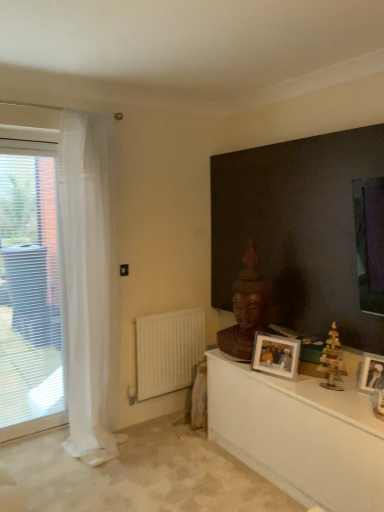
The image size is (384, 512). What do you see at coordinates (275, 355) in the screenshot?
I see `wooden photo frame at center, the 1th picture frame from the back` at bounding box center [275, 355].

Measure the distance between point (x=276, y=272) and camera.

Point (x=276, y=272) and camera are 9.17 feet apart from each other.

The height and width of the screenshot is (512, 384). What do you see at coordinates (306, 230) in the screenshot?
I see `dark wood buddha head at center` at bounding box center [306, 230].

In order to face metallic silver photo frame at right, the 2th picture frame positioned from the back, should I rotate leftwards or rightwards?

To align with it, rotate right about 23.465°.

The width and height of the screenshot is (384, 512). Describe the element at coordinates (371, 373) in the screenshot. I see `metallic silver photo frame at right, positioned as the 2th picture frame in left-to-right order` at that location.

Consider the image. What is the approximate width of transparent glass window at left?

The width of transparent glass window at left is 4.54 inches.

Measure the distance between white sheer curtain at left and camera.

The distance of white sheer curtain at left from camera is 2.59 meters.

Where is `white sheer curtain at left`? white sheer curtain at left is located at coordinates [87, 287].

What do you see at coordinates (248, 309) in the screenshot? I see `brown wooden statue at center` at bounding box center [248, 309].

This screenshot has height=512, width=384. In order to click on white glossy table at lower right in this screenshot , I will do `click(299, 435)`.

You are a GUI agent. You are given a task and a screenshot of the screen. Output one action in this format:
    pyautogui.click(x=<x>, y=<y>)
    Task: Click on the wooden photo frame at center, the 1th picture frame from the back
    
    Given the screenshot: What is the action you would take?
    pyautogui.click(x=275, y=355)

Does point (292, 265) lie in front of point (257, 327)?

No.

Between dark wood buddha head at center and brown wooden statue at center, which one is positioned behind?

Positioned behind is brown wooden statue at center.

From a real-world perspective, is dark wood buddha head at center above or below brown wooden statue at center?

In terms of real-world spatial position, dark wood buddha head at center is above brown wooden statue at center.

Is white sheer curtain at left wider or thinner than metallic silver photo frame at right, arranged as the 1th picture frame when viewed from the front?

In the image, white sheer curtain at left appears to be wider than metallic silver photo frame at right, arranged as the 1th picture frame when viewed from the front.

Which is more to the right, white sheer curtain at left or metallic silver photo frame at right, positioned as the 2th picture frame in left-to-right order?

From the viewer's perspective, metallic silver photo frame at right, positioned as the 2th picture frame in left-to-right order, appears more on the right side.

Is white sheer curtain at left facing towards metallic silver photo frame at right, the 2th picture frame positioned from the back?

No, white sheer curtain at left is not facing towards metallic silver photo frame at right, the 2th picture frame positioned from the back.

Considering the sizes of objects white sheer curtain at left and metallic silver photo frame at right, placed as the first picture frame when sorted from right to left, in the image provided, who is shorter, white sheer curtain at left or metallic silver photo frame at right, placed as the first picture frame when sorted from right to left,?

metallic silver photo frame at right, placed as the first picture frame when sorted from right to left, is shorter.

Between dark wood buddha head at center and wooden toy at right, which one has more height?

Standing taller between the two is dark wood buddha head at center.

Does dark wood buddha head at center turn towards wooden toy at right?

Yes, dark wood buddha head at center faces towards wooden toy at right.

From the image's perspective, is dark wood buddha head at center on wooden toy at right?

Correct, dark wood buddha head at center appears higher than wooden toy at right in the image.

Between dark wood buddha head at center and wooden toy at right, which one appears on the left side from the viewer's perspective?

dark wood buddha head at center.

Which object is more forward, white glossy table at lower right or white sheer curtain at left?

A: white glossy table at lower right is closer to the camera.

Can you confirm if white glossy table at lower right is shorter than white sheer curtain at left?

Yes, white glossy table at lower right is shorter than white sheer curtain at left.

From the image's perspective, is white glossy table at lower right under white sheer curtain at left?

Correct, white glossy table at lower right appears lower than white sheer curtain at left in the image.

Where is `table located underneath the white sheer curtain at left (from a real-world perspective)`? table located underneath the white sheer curtain at left (from a real-world perspective) is located at coordinates (299, 435).

Is white matte radiator at lower left shorter than dark wood buddha head at center?

Indeed, white matte radiator at lower left has a lesser height compared to dark wood buddha head at center.

In the scene shown: From a real-world perspective, does white matte radiator at lower left stand above dark wood buddha head at center?

No, from a real-world perspective, white matte radiator at lower left is not on top of dark wood buddha head at center.

How many degrees apart are the facing directions of white matte radiator at lower left and dark wood buddha head at center?

The angular difference between white matte radiator at lower left and dark wood buddha head at center is 90.3 degrees.

Is white matte radiator at lower left at the back of transparent glass window at left?

No.

I want to click on radiator below the transparent glass window at left (from a real-world perspective), so click(168, 351).

Can we say transparent glass window at left lies outside white matte radiator at lower left?

Yes, transparent glass window at left is outside of white matte radiator at lower left.

Does wooden toy at right have a larger size compared to transparent glass window at left?

Actually, wooden toy at right might be smaller than transparent glass window at left.

From a real-world perspective, is wooden toy at right physically located above or below transparent glass window at left?

wooden toy at right is situated lower than transparent glass window at left in the real world.

Do you think wooden toy at right is within transparent glass window at left, or outside of it?

The correct answer is: outside.

Is wooden toy at right far away from transparent glass window at left?

Yes.

This screenshot has width=384, height=512. I want to click on person below the dark wood buddha head at center (from a real-world perspective), so click(x=248, y=309).

This screenshot has height=512, width=384. What are the coordinates of `curtain on the left side of metallic silver photo frame at right, placed as the first picture frame when sorted from right to left` in the screenshot? It's located at (87, 287).

When comparing their distances from white glossy table at lower right, does transparent glass window at left or wooden toy at right seem further?

transparent glass window at left is positioned further to the anchor white glossy table at lower right.

Considering their positions, is metallic silver photo frame at right, arranged as the 1th picture frame when viewed from the front, positioned further to wooden photo frame at center, the 1th picture frame from the back, than brown wooden statue at center?

→ Based on the image, metallic silver photo frame at right, arranged as the 1th picture frame when viewed from the front, appears to be further to wooden photo frame at center, the 1th picture frame from the back.

Considering their positions, is wooden toy at right positioned further to wooden photo frame at center, the 1th picture frame from the back, than white matte radiator at lower left?

white matte radiator at lower left is further to wooden photo frame at center, the 1th picture frame from the back.

Estimate the real-world distances between objects in this image. Which object is closer to wooden photo frame at center, which appears as the 2th picture frame when viewed from the right, white sheer curtain at left or white glossy table at lower right?

white glossy table at lower right lies closer to wooden photo frame at center, which appears as the 2th picture frame when viewed from the right, than the other object.

Based on the photo, based on their spatial positions, is wooden toy at right or transparent glass window at left closer to brown wooden statue at center?

Based on the image, wooden toy at right appears to be nearer to brown wooden statue at center.

Which object lies further to the anchor point transparent glass window at left, white sheer curtain at left or wooden photo frame at center, the 1th picture frame from the back?

Result: Based on the image, wooden photo frame at center, the 1th picture frame from the back, appears to be further to transparent glass window at left.

Looking at the image, which one is located closer to metallic silver photo frame at right, placed as the first picture frame when sorted from right to left, white glossy table at lower right or brown wooden statue at center?

white glossy table at lower right lies closer to metallic silver photo frame at right, placed as the first picture frame when sorted from right to left, than the other object.

Considering their positions, is wooden photo frame at center, the 1th picture frame from the back, positioned closer to transparent glass window at left than metallic silver photo frame at right, arranged as the 1th picture frame when viewed from the front?

Among the two, wooden photo frame at center, the 1th picture frame from the back, is located nearer to transparent glass window at left.

Locate an element on the screen. toy between dark wood buddha head at center and white glossy table at lower right in the vertical direction is located at coordinates (332, 361).

Find the location of a particular element. This screenshot has width=384, height=512. toy between dark wood buddha head at center and metallic silver photo frame at right, the 2th picture frame positioned from the back, vertically is located at coordinates (332, 361).

Locate an element on the screen. This screenshot has height=512, width=384. person between transparent glass window at left and metallic silver photo frame at right, positioned as the 2th picture frame in left-to-right order, from left to right is located at coordinates (248, 309).

You are a GUI agent. You are given a task and a screenshot of the screen. Output one action in this format:
    pyautogui.click(x=<x>, y=<y>)
    Task: Click on the backdrop located between white sheer curtain at left and wooden toy at right in the left-right direction
    Image resolution: width=384 pixels, height=512 pixels.
    Given the screenshot: What is the action you would take?
    pyautogui.click(x=306, y=230)